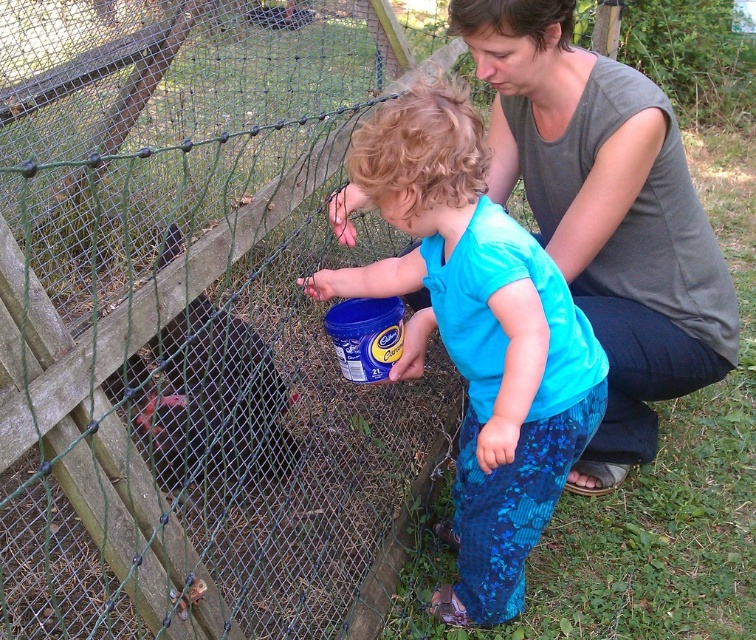
Between point (567, 380) and point (578, 132), which one is positioned behind?

The point (578, 132) is more distant.

Describe the element at coordinates (479, 337) in the screenshot. I see `blue matte shirt at center` at that location.

Between point (550, 385) and point (596, 337), which one is positioned behind?

The point (596, 337) is behind.

Locate an element on the screen. The height and width of the screenshot is (640, 756). blue matte shirt at center is located at coordinates (479, 337).